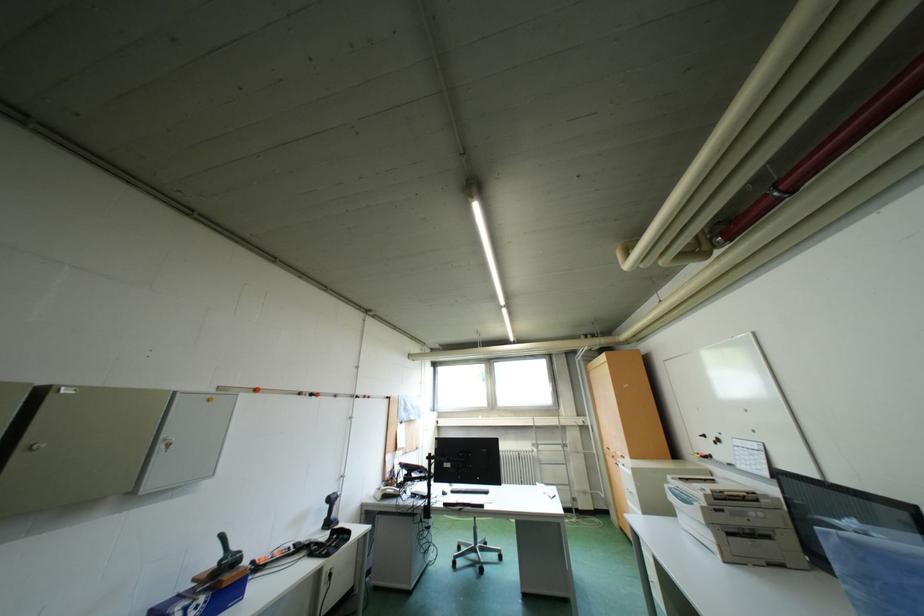
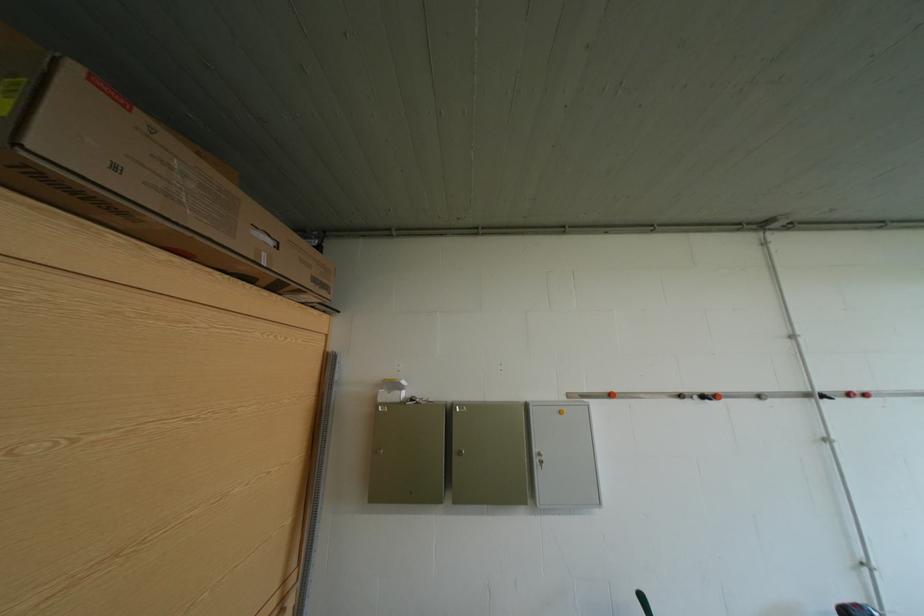
Question: Based on the continuous images, in which direction is the camera rotating? Reply with the corresponding letter.

Choices:
 (A) Left
 (B) Right
 (C) Up
 (D) Down

Answer: (A)